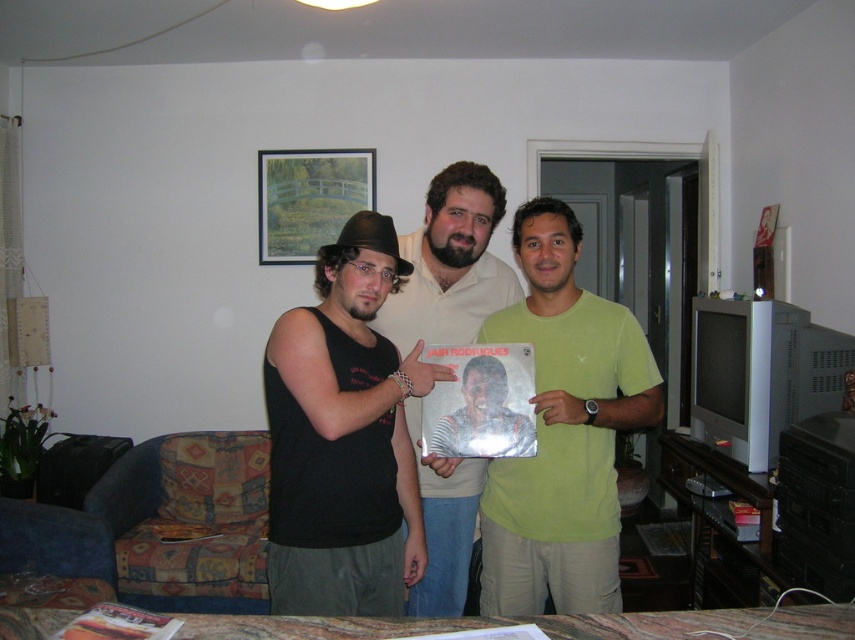
You are standing in the living room and want to find the location of the point marked at coordinates (563, 432). Based on the scene description, where is this point located?

The point marked at coordinates (563, 432) is located on the green matte shirt at center.

You are trying to decide which of the two shirts at the center of the image would be more comfortable to wear based on their size. Since the black matte tank top at center is narrower than the green matte shirt at center, which one might be more comfortable for someone who prefers looser clothing?

The green matte shirt at center would be more comfortable for someone who prefers looser clothing since its width is greater than the black matte tank top at center.